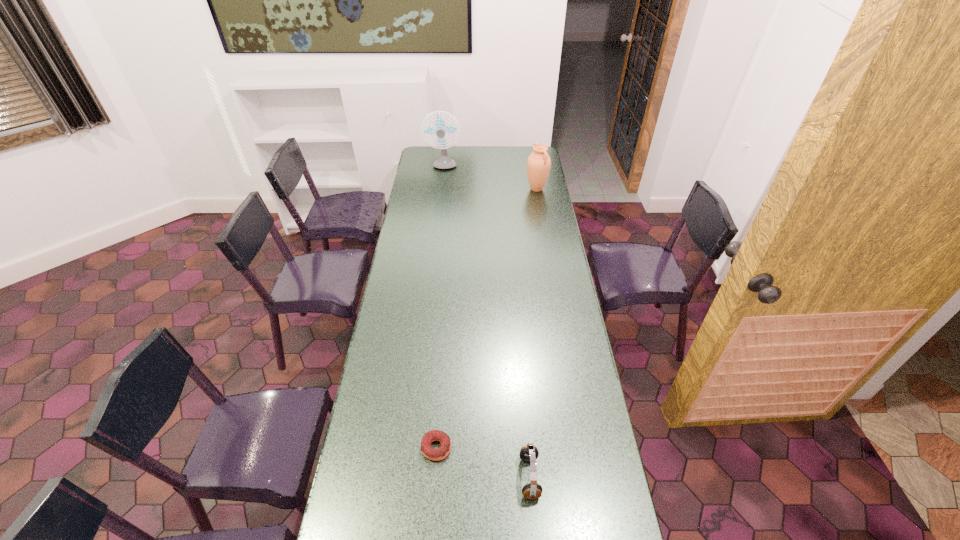
Where is `free spot between the tallest object and the doughnut`? The image size is (960, 540). free spot between the tallest object and the doughnut is located at coordinates (440, 308).

Locate which object is the closest to the shortest object. Please provide its 2D coordinates. Your answer should be formatted as a tuple, i.e. [(x, y)], where the tuple contains the x and y coordinates of a point satisfying the conditions above.

[(529, 453)]

Locate which object ranks in proximity to the farthest object. Please provide its 2D coordinates. Your answer should be formatted as a tuple, i.e. [(x, y)], where the tuple contains the x and y coordinates of a point satisfying the conditions above.

[(538, 164)]

I want to click on free location that satisfies the following two spatial constraints: 1. on the back side of the shortest object; 2. on the left side of the third shortest object, so click(456, 189).

The width and height of the screenshot is (960, 540). Identify the location of vacant space that satisfies the following two spatial constraints: 1. on the front-facing side of the urn; 2. on the left side of the fan. (441, 189).

Find the location of `free space that satisfies the following two spatial constraints: 1. on the front-facing side of the tallest object; 2. on the left side of the rightmost object`. free space that satisfies the following two spatial constraints: 1. on the front-facing side of the tallest object; 2. on the left side of the rightmost object is located at coordinates (441, 189).